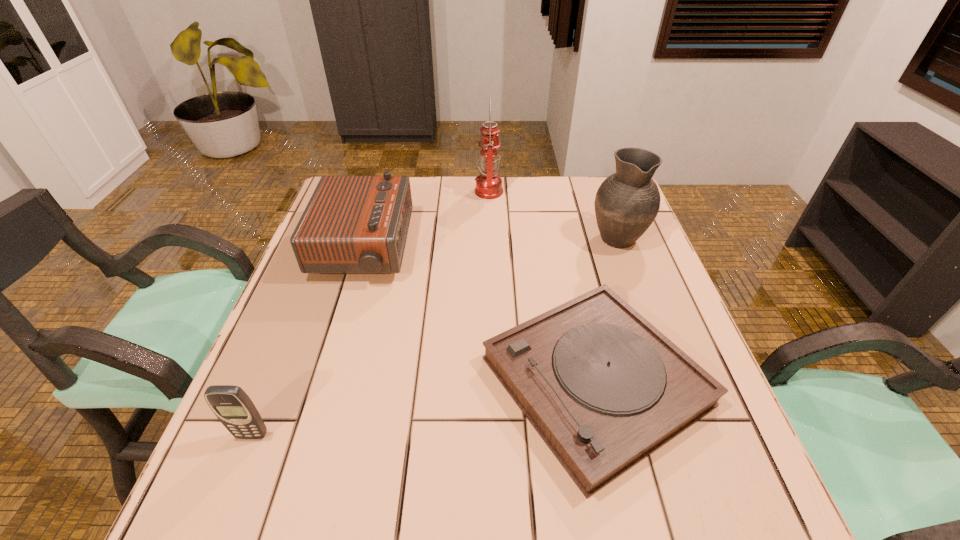
You are a GUI agent. You are given a task and a screenshot of the screen. Output one action in this format:
    pyautogui.click(x=<x>, y=<y>)
    Task: Click on the vacant region between the shortest object and the farthest object
    This screenshot has width=960, height=540.
    Given the screenshot: What is the action you would take?
    pyautogui.click(x=541, y=286)

You are a GUI agent. You are given a task and a screenshot of the screen. Output one action in this format:
    pyautogui.click(x=<x>, y=<y>)
    Task: Click on the free space between the oil lamp and the cellular telephone
    This screenshot has height=540, width=960.
    Given the screenshot: What is the action you would take?
    pyautogui.click(x=371, y=313)

Locate an element on the screen. The height and width of the screenshot is (540, 960). free space between the cellular telephone and the shortest object is located at coordinates (423, 408).

Where is `empty location between the radio receiver and the pitcher`? empty location between the radio receiver and the pitcher is located at coordinates (490, 243).

I want to click on free space between the radio receiver and the tallest object, so click(x=426, y=220).

Locate an element on the screen. The width and height of the screenshot is (960, 540). vacant space that's between the shortest object and the radio receiver is located at coordinates (479, 315).

Where is `empty space that is in between the farthest object and the radio receiver`? Image resolution: width=960 pixels, height=540 pixels. empty space that is in between the farthest object and the radio receiver is located at coordinates (426, 220).

Locate an element on the screen. Image resolution: width=960 pixels, height=540 pixels. vacant point located between the phonograph record and the radio receiver is located at coordinates (479, 315).

Locate which object ranks second in proximity to the phonograph record. Please provide its 2D coordinates. Your answer should be formatted as a tuple, i.e. [(x, y)], where the tuple contains the x and y coordinates of a point satisfying the conditions above.

[(352, 224)]

Locate which object ranks second in proximity to the cellular telephone. Please provide its 2D coordinates. Your answer should be formatted as a tuple, i.e. [(x, y)], where the tuple contains the x and y coordinates of a point satisfying the conditions above.

[(604, 388)]